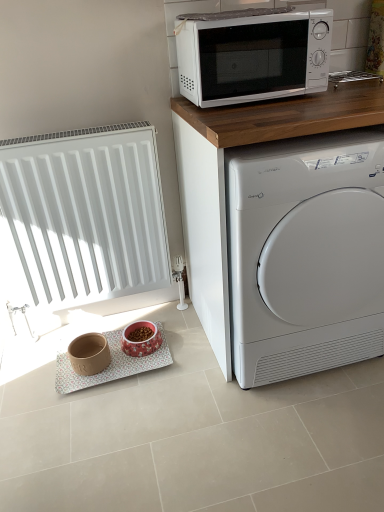
Measure the distance between white glossy washing machine at right and camera.

3.65 feet.

Where is `pink glossy bowl at lower center, the 2th appliance viewed from the left`? The width and height of the screenshot is (384, 512). pink glossy bowl at lower center, the 2th appliance viewed from the left is located at coordinates (141, 339).

This screenshot has height=512, width=384. What do you see at coordinates (252, 54) in the screenshot? I see `white glossy microwave at upper center` at bounding box center [252, 54].

Where is `white glossy washing machine at right`? white glossy washing machine at right is located at coordinates (306, 255).

Looking at this image, from the image's perspective, who appears lower, matte brown bowl at lower left, the 1th appliance when ordered from left to right, or pink glossy bowl at lower center, the first appliance viewed from the right?

matte brown bowl at lower left, the 1th appliance when ordered from left to right.

From a real-world perspective, is matte brown bowl at lower left, the 1th appliance when ordered from left to right, under pink glossy bowl at lower center, the first appliance viewed from the right?

No, from a real-world perspective, matte brown bowl at lower left, the 1th appliance when ordered from left to right, is not below pink glossy bowl at lower center, the first appliance viewed from the right.

Where is `appliance positioned vertically above the pink glossy bowl at lower center, the 2th appliance viewed from the left (from a real-world perspective)`? The height and width of the screenshot is (512, 384). appliance positioned vertically above the pink glossy bowl at lower center, the 2th appliance viewed from the left (from a real-world perspective) is located at coordinates (89, 354).

Is matte brown bowl at lower left, marked as the 2th appliance in a right-to-left arrangement, outside of pink glossy bowl at lower center, the 2th appliance viewed from the left?

That's correct, matte brown bowl at lower left, marked as the 2th appliance in a right-to-left arrangement, is outside of pink glossy bowl at lower center, the 2th appliance viewed from the left.

Between white matte radiator at left and white glossy microwave at upper center, which one has more height?

Standing taller between the two is white matte radiator at left.

From a real-world perspective, is white matte radiator at left located higher than white glossy microwave at upper center?

Incorrect, from a real-world perspective, white matte radiator at left is lower than white glossy microwave at upper center.

Who is more distant, white matte radiator at left or white glossy microwave at upper center?

white matte radiator at left.

From the image's perspective, is white matte radiator at left located above or below white glossy microwave at upper center?

white matte radiator at left is situated lower than white glossy microwave at upper center in the image.

Between white matte radiator at left and white glossy washing machine at right, which one has larger width?

With larger width is white glossy washing machine at right.

Is the surface of white matte radiator at left in direct contact with white glossy washing machine at right?

white matte radiator at left and white glossy washing machine at right are not in contact.

Can you confirm if white matte radiator at left is positioned to the right of white glossy washing machine at right?

In fact, white matte radiator at left is to the left of white glossy washing machine at right.

Does white glossy washing machine at right have a lesser width compared to pink glossy bowl at lower center, the first appliance viewed from the right?

In fact, white glossy washing machine at right might be wider than pink glossy bowl at lower center, the first appliance viewed from the right.

Considering the relative positions of white glossy washing machine at right and pink glossy bowl at lower center, the 2th appliance viewed from the left, in the image provided, is white glossy washing machine at right to the right of pink glossy bowl at lower center, the 2th appliance viewed from the left, from the viewer's perspective?

Correct, you'll find white glossy washing machine at right to the right of pink glossy bowl at lower center, the 2th appliance viewed from the left.

Is point (308, 329) farther from camera compared to point (137, 347)?

No.

From the image's perspective, is pink glossy bowl at lower center, the 2th appliance viewed from the left, under white glossy microwave at upper center?

Yes.

Considering the positions of points (123, 332) and (287, 21), is point (123, 332) farther from camera compared to point (287, 21)?

Yes, point (123, 332) is farther from viewer.

Based on the photo, in the image, is pink glossy bowl at lower center, the first appliance viewed from the right, on the left side or the right side of white glossy microwave at upper center?

In the image, pink glossy bowl at lower center, the first appliance viewed from the right, appears on the left side of white glossy microwave at upper center.

What's the angular difference between pink glossy bowl at lower center, the first appliance viewed from the right, and white glossy microwave at upper center's facing directions?

The facing directions of pink glossy bowl at lower center, the first appliance viewed from the right, and white glossy microwave at upper center are 0.000558 degrees apart.

Consider the image. Which object is positioned more to the left, white glossy microwave at upper center or pink glossy bowl at lower center, the 2th appliance viewed from the left?

Positioned to the left is pink glossy bowl at lower center, the 2th appliance viewed from the left.

Does white glossy microwave at upper center turn towards pink glossy bowl at lower center, the first appliance viewed from the right?

No, white glossy microwave at upper center is not facing towards pink glossy bowl at lower center, the first appliance viewed from the right.

Does point (186, 64) appear closer or farther from the camera than point (137, 342)?

Point (186, 64) is closer to the camera than point (137, 342).

Based on the photo, considering the sizes of objects white glossy microwave at upper center and pink glossy bowl at lower center, the first appliance viewed from the right, in the image provided, who is smaller, white glossy microwave at upper center or pink glossy bowl at lower center, the first appliance viewed from the right,?

pink glossy bowl at lower center, the first appliance viewed from the right, is smaller.

Who is shorter, matte brown bowl at lower left, marked as the 2th appliance in a right-to-left arrangement, or white glossy washing machine at right?

Standing shorter between the two is matte brown bowl at lower left, marked as the 2th appliance in a right-to-left arrangement.

Would you say matte brown bowl at lower left, the 1th appliance when ordered from left to right, is outside white glossy washing machine at right?

That's correct, matte brown bowl at lower left, the 1th appliance when ordered from left to right, is outside of white glossy washing machine at right.

Considering the positions of objects matte brown bowl at lower left, the 1th appliance when ordered from left to right, and white glossy washing machine at right in the image provided, who is more to the left, matte brown bowl at lower left, the 1th appliance when ordered from left to right, or white glossy washing machine at right?

matte brown bowl at lower left, the 1th appliance when ordered from left to right.

Measure the distance from matte brown bowl at lower left, marked as the 2th appliance in a right-to-left arrangement, to white glossy washing machine at right.

matte brown bowl at lower left, marked as the 2th appliance in a right-to-left arrangement, is 33.32 inches away from white glossy washing machine at right.

You are a GUI agent. You are given a task and a screenshot of the screen. Output one action in this format:
    pyautogui.click(x=<x>, y=<y>)
    Task: Click on the appliance on the left of pink glossy bowl at lower center, the 2th appliance viewed from the left
    
    Given the screenshot: What is the action you would take?
    pyautogui.click(x=89, y=354)

This screenshot has width=384, height=512. Identify the location of radiator below the white glossy microwave at upper center (from the image's perspective). (85, 214).

Based on their spatial positions, is pink glossy bowl at lower center, the 2th appliance viewed from the left, or matte brown bowl at lower left, marked as the 2th appliance in a right-to-left arrangement, further from white glossy microwave at upper center?

matte brown bowl at lower left, marked as the 2th appliance in a right-to-left arrangement, is positioned further to the anchor white glossy microwave at upper center.

Estimate the real-world distances between objects in this image. Which object is further from pink glossy bowl at lower center, the 2th appliance viewed from the left, white matte radiator at left or white glossy microwave at upper center?

white glossy microwave at upper center is positioned further to the anchor pink glossy bowl at lower center, the 2th appliance viewed from the left.

Which object lies nearer to the anchor point white matte radiator at left, white glossy microwave at upper center or pink glossy bowl at lower center, the 2th appliance viewed from the left?

pink glossy bowl at lower center, the 2th appliance viewed from the left, is closer to white matte radiator at left.

Looking at the image, which one is located further to white matte radiator at left, pink glossy bowl at lower center, the first appliance viewed from the right, or white glossy microwave at upper center?

The object further to white matte radiator at left is white glossy microwave at upper center.

Looking at the image, which one is located further to white glossy microwave at upper center, matte brown bowl at lower left, marked as the 2th appliance in a right-to-left arrangement, or white glossy washing machine at right?

matte brown bowl at lower left, marked as the 2th appliance in a right-to-left arrangement.

Considering their positions, is matte brown bowl at lower left, the 1th appliance when ordered from left to right, positioned further to pink glossy bowl at lower center, the 2th appliance viewed from the left, than white glossy microwave at upper center?

white glossy microwave at upper center is further to pink glossy bowl at lower center, the 2th appliance viewed from the left.

Which object lies nearer to the anchor point white glossy washing machine at right, white glossy microwave at upper center or pink glossy bowl at lower center, the first appliance viewed from the right?

Based on the image, white glossy microwave at upper center appears to be nearer to white glossy washing machine at right.

Which object lies further to the anchor point white glossy washing machine at right, pink glossy bowl at lower center, the first appliance viewed from the right, or matte brown bowl at lower left, marked as the 2th appliance in a right-to-left arrangement?

matte brown bowl at lower left, marked as the 2th appliance in a right-to-left arrangement, is positioned further to the anchor white glossy washing machine at right.

The image size is (384, 512). Find the location of `washing machine between white glossy microwave at upper center and pink glossy bowl at lower center, the first appliance viewed from the right, from top to bottom`. washing machine between white glossy microwave at upper center and pink glossy bowl at lower center, the first appliance viewed from the right, from top to bottom is located at coordinates (306, 255).

What are the coordinates of `appliance between white glossy microwave at upper center and matte brown bowl at lower left, the 1th appliance when ordered from left to right, vertically` in the screenshot? It's located at (141, 339).

Locate an element on the screen. The width and height of the screenshot is (384, 512). appliance that lies between white matte radiator at left and matte brown bowl at lower left, the 1th appliance when ordered from left to right, from top to bottom is located at coordinates (141, 339).

You are a GUI agent. You are given a task and a screenshot of the screen. Output one action in this format:
    pyautogui.click(x=<x>, y=<y>)
    Task: Click on the appliance located between matte brown bowl at lower left, the 1th appliance when ordered from left to right, and white glossy washing machine at right in the left-right direction
    The height and width of the screenshot is (512, 384).
    Given the screenshot: What is the action you would take?
    pyautogui.click(x=141, y=339)